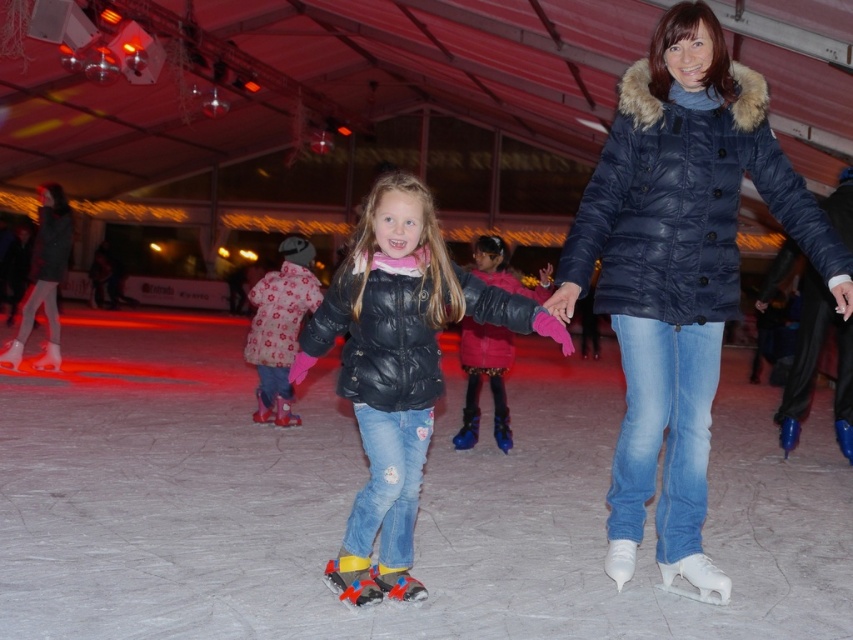
Is white smooth ice at center to the right of matte black jacket at center from the viewer's perspective?

No, white smooth ice at center is not to the right of matte black jacket at center.

Does point (525, 467) lie behind point (404, 224)?

Yes.

This screenshot has height=640, width=853. Describe the element at coordinates (358, 486) in the screenshot. I see `white smooth ice at center` at that location.

Where is `white smooth ice at center`? The image size is (853, 640). white smooth ice at center is located at coordinates click(x=358, y=486).

Can you confirm if fluffy pink snowsuit at center is positioned above velvet pink jacket at center?

Incorrect, fluffy pink snowsuit at center is not positioned above velvet pink jacket at center.

From the picture: Is fluffy pink snowsuit at center smaller than velvet pink jacket at center?

No.

Identify the location of fluffy pink snowsuit at center. Image resolution: width=853 pixels, height=640 pixels. pyautogui.click(x=280, y=326).

Can you confirm if matte black jacket at center is positioned to the left of fluffy pink snowsuit at center?

In fact, matte black jacket at center is to the right of fluffy pink snowsuit at center.

Who is positioned more to the left, matte black jacket at center or fluffy pink snowsuit at center?

Positioned to the left is fluffy pink snowsuit at center.

Is point (339, 369) in front of point (257, 401)?

That is True.

Find the location of `matte black jacket at center`. matte black jacket at center is located at coordinates (397, 369).